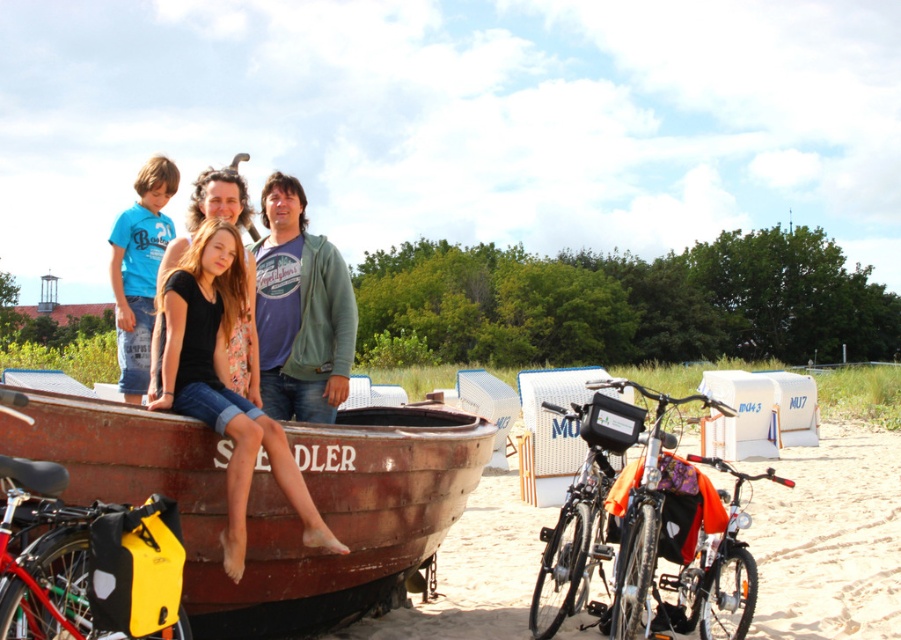
Can you confirm if rusty wooden boat at center is bigger than yellow matte bag at lower left?

Correct, rusty wooden boat at center is larger in size than yellow matte bag at lower left.

Is the position of rusty wooden boat at center more distant than that of yellow matte bag at lower left?

Yes, it is behind yellow matte bag at lower left.

Locate an element on the screen. This screenshot has height=640, width=901. rusty wooden boat at center is located at coordinates (272, 500).

Where is `rusty wooden boat at center`? The image size is (901, 640). rusty wooden boat at center is located at coordinates (272, 500).

Which of these two, yellow matte bag at lower left or matte green hoodie at center, stands taller?

Standing taller between the two is yellow matte bag at lower left.

From the picture: Who is positioned more to the right, yellow matte bag at lower left or matte green hoodie at center?

Positioned to the right is yellow matte bag at lower left.

Between point (64, 554) and point (162, 262), which one is positioned in front?

Point (64, 554) is more forward.

Locate an element on the screen. This screenshot has height=640, width=901. yellow matte bag at lower left is located at coordinates (87, 563).

Does matte black shirt at center lie in front of green cotton hoodie at center?

Yes, it is.

Does point (177, 298) come in front of point (264, 326)?

That is True.

What are the coordinates of `matte black shirt at center` in the screenshot? It's located at (223, 384).